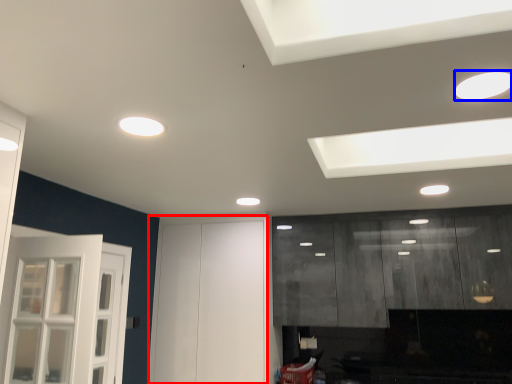
Question: Which object appears closest to the camera in this image, door (highlighted by a red box) or lighting (highlighted by a blue box)?

Choices:
 (A) door
 (B) lighting

Answer: (B)